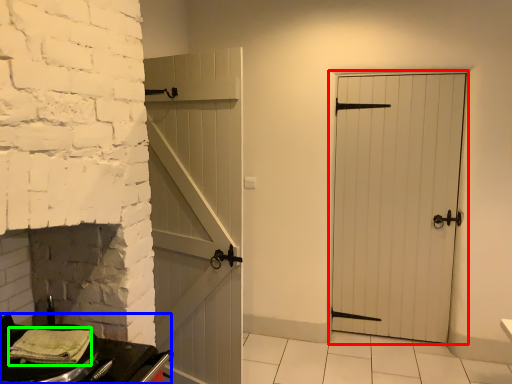
Question: Estimate the real-world distances between objects in this image. Which object is closer to door (highlighted by a red box), table (highlighted by a blue box) or material (highlighted by a green box)?

Choices:
 (A) table
 (B) material

Answer: (A)